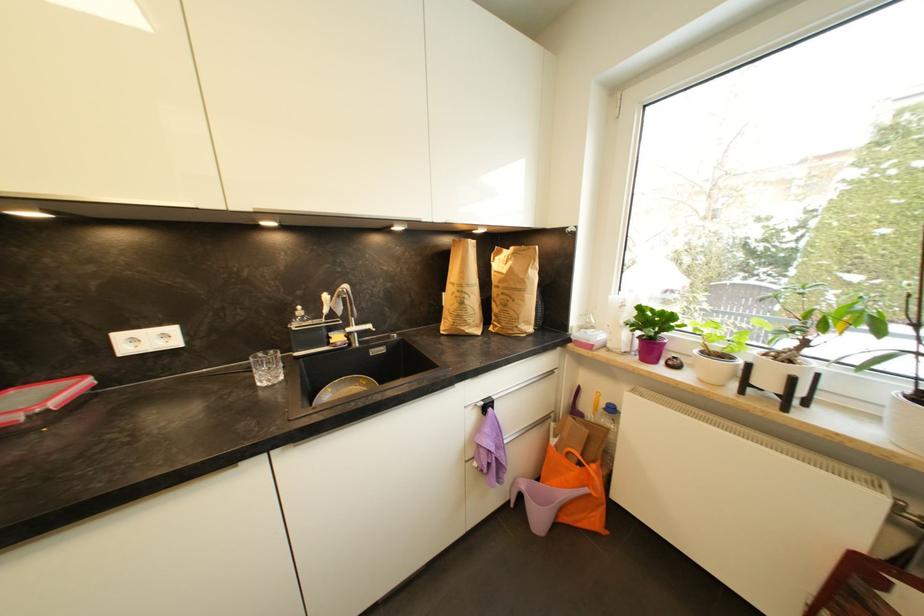
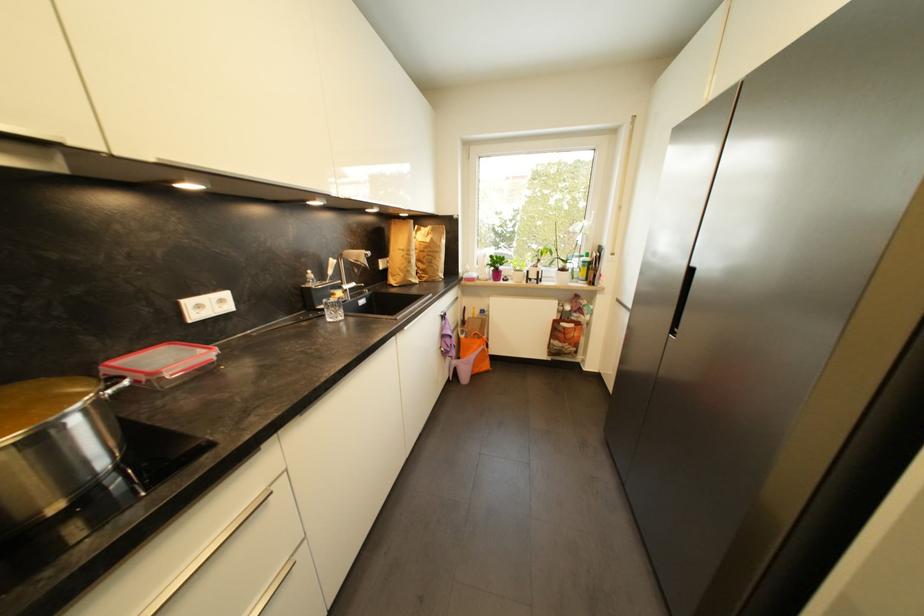
Locate, in the second image, the point that corresponds to the point at 467,305 in the first image.

(415, 264)